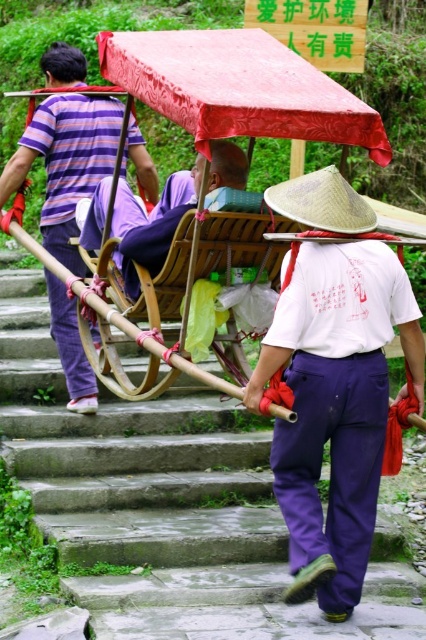
You are a tailor observing the clothing items in the scene. Which clothing item has a narrower width between the white cotton shirt at center and the purple cotton pants at center?

The white cotton shirt at center has a lesser width compared to the purple cotton pants at center, so the white cotton shirt at center is narrower in width.

Based on the scene description, can you determine the position of the white cotton shirt at center relative to the wooden cart at center?

The white cotton shirt at center is located below the wooden cart at center.

You are a tailor observing a scene with two people wearing shirts. You need to determine which shirt is smaller in size between the white cotton shirt at center and the purple striped shirt at upper left. Which one is smaller?

The white cotton shirt at center is smaller in size compared to the purple striped shirt at upper left.